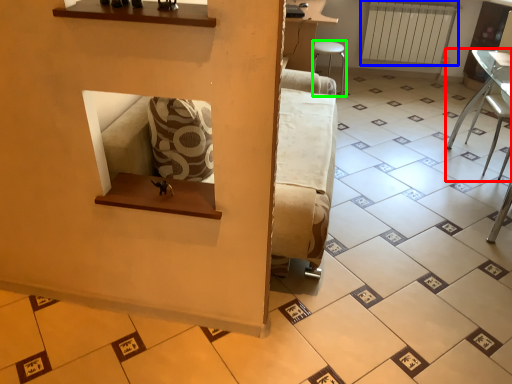
Question: Considering the real-world distances, which object is closest to furniture (highlighted by a red box)? radiator (highlighted by a blue box) or furniture (highlighted by a green box).

Choices:
 (A) radiator
 (B) furniture

Answer: (A)